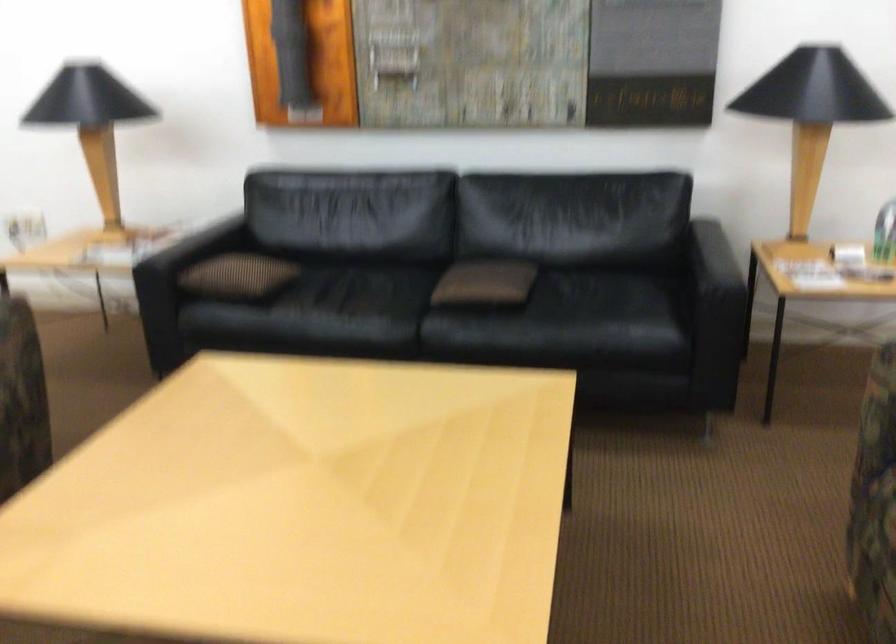
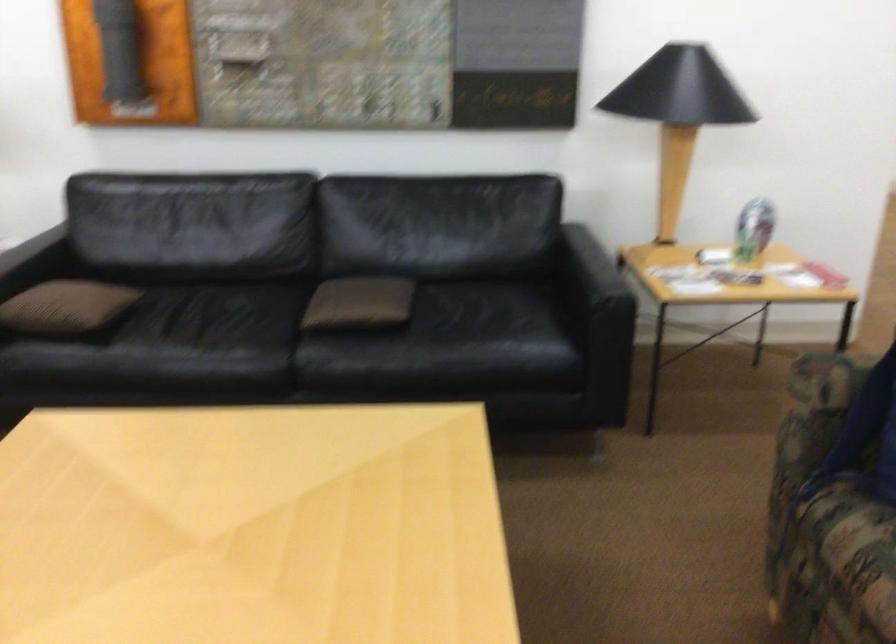
Question: The camera is either moving clockwise (left) or counter-clockwise (right) around the object. The first image is from the beginning of the video and the second image is from the end. Is the camera moving left or right when shooting the video?

Choices:
 (A) Left
 (B) Right

Answer: (A)